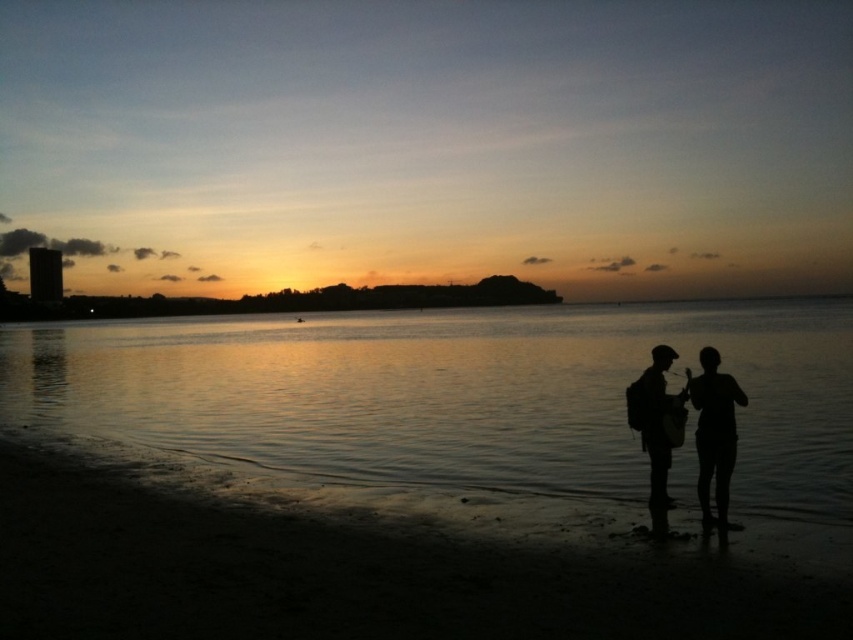
Question: Which object is farther from the camera taking this photo?

Choices:
 (A) dark sand at lower left
 (B) silhouette figure at lower right
 (C) glistening water at center

Answer: (C)

Question: Observing the image, what is the correct spatial positioning of glistening water at center in reference to black matte backpack at lower right?

Choices:
 (A) right
 (B) left

Answer: (A)

Question: Can you confirm if dark sand at lower left is wider than black matte backpack at lower right?

Choices:
 (A) no
 (B) yes

Answer: (B)

Question: Which object appears closest to the camera in this image?

Choices:
 (A) silhouette backpack at lower right
 (B) glistening water at center
 (C) silhouette figure at lower right

Answer: (C)

Question: Does silhouette backpack at lower right appear under black matte backpack at lower right?

Choices:
 (A) no
 (B) yes

Answer: (A)

Question: Estimate the real-world distances between objects in this image. Which object is farther from the glistening water at center?

Choices:
 (A) silhouette figure at lower right
 (B) dark sand at lower left
 (C) black matte backpack at lower right

Answer: (B)